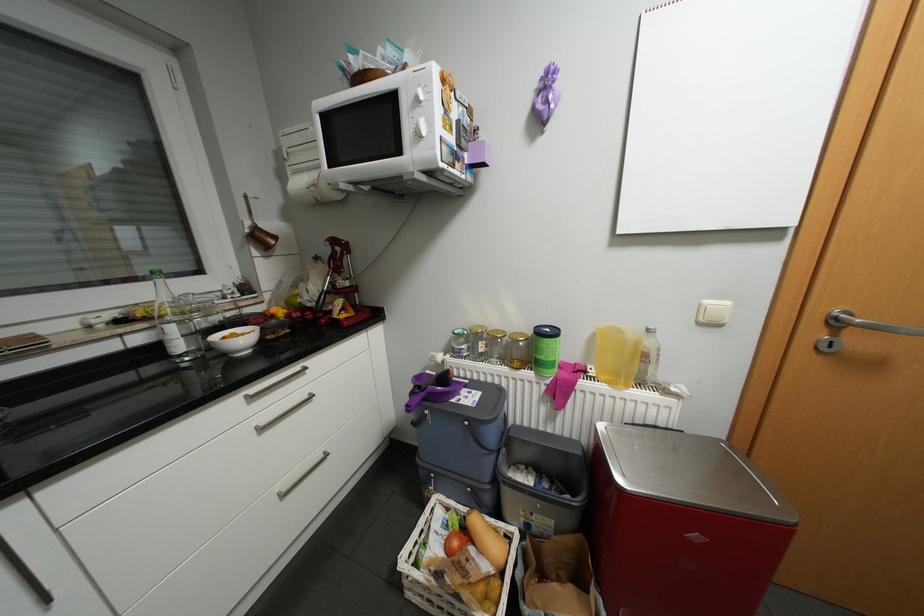
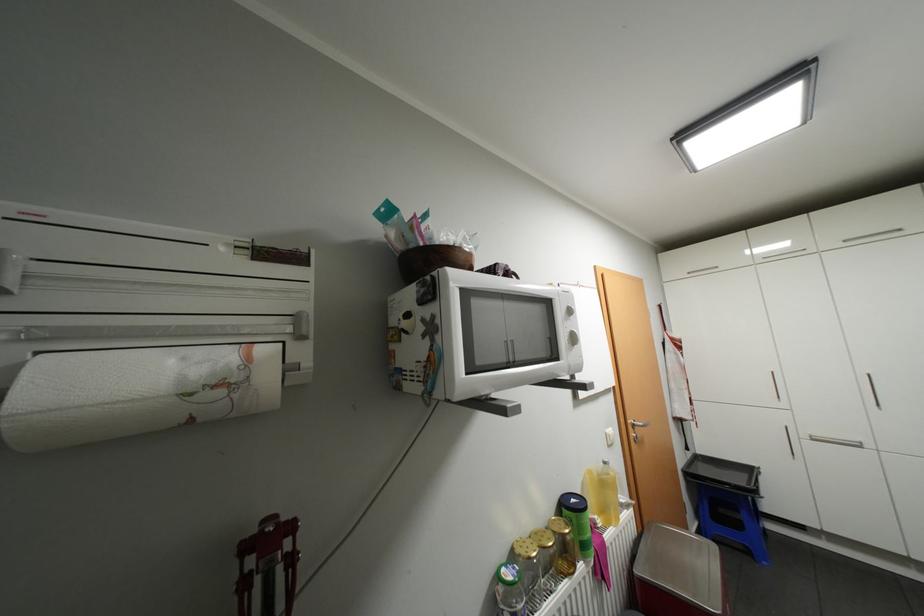
Find the pixel in the second image that matches point 554,329 in the first image.

(580, 499)